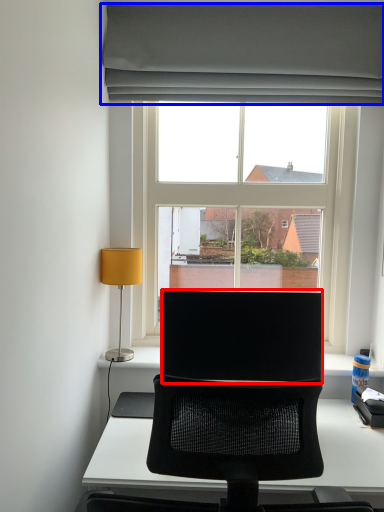
Question: Which of the following is the closest to the observer, computer monitor (highlighted by a red box) or curtain (highlighted by a blue box)?

Choices:
 (A) computer monitor
 (B) curtain

Answer: (A)